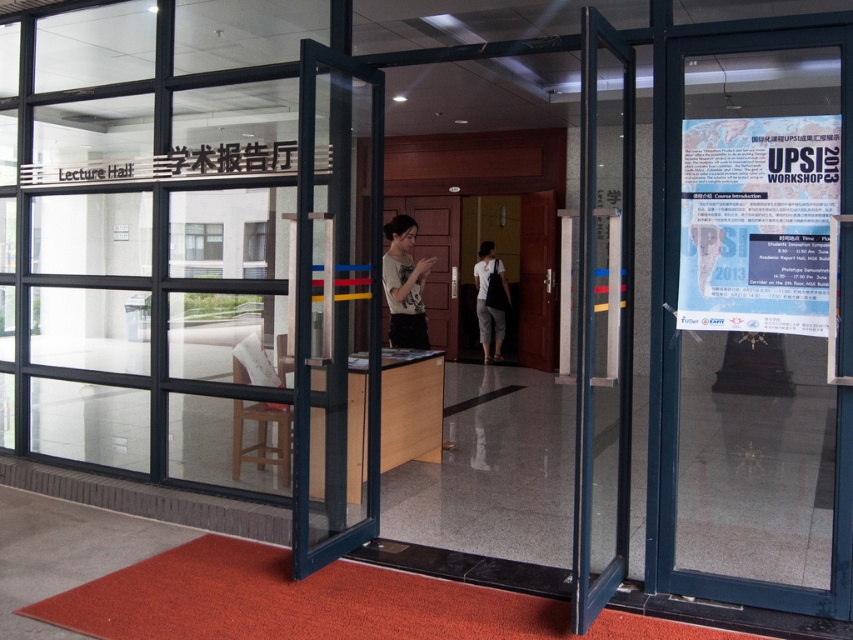
Question: Estimate the real-world distances between objects in this image. Which object is closer to the transparent glass door at right?

Choices:
 (A) matte white t-shirt at center
 (B) white cotton shirt at center

Answer: (B)

Question: Which point is farther to the camera?

Choices:
 (A) transparent glass door at right
 (B) matte white t-shirt at center

Answer: (A)

Question: Can you confirm if transparent glass door at right is positioned below matte white t-shirt at center?

Choices:
 (A) no
 (B) yes

Answer: (B)

Question: Can you confirm if transparent glass door at right is smaller than matte white t-shirt at center?

Choices:
 (A) no
 (B) yes

Answer: (B)

Question: Which point is farther from the camera taking this photo?

Choices:
 (A) (492, 257)
 (B) (396, 243)
 (C) (828, 88)

Answer: (A)

Question: Can you confirm if matte white t-shirt at center is positioned below white cotton shirt at center?

Choices:
 (A) no
 (B) yes

Answer: (A)